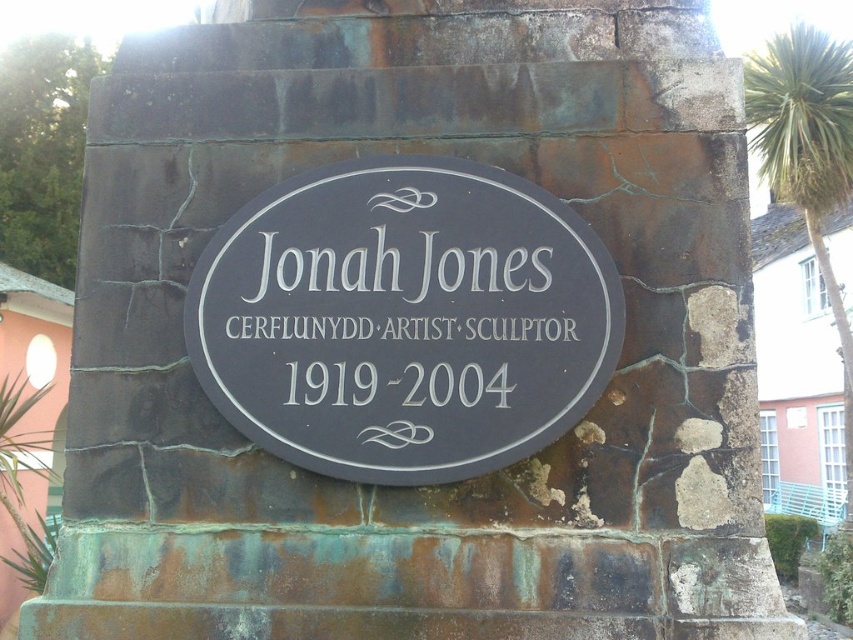
What do you see at coordinates (404, 320) in the screenshot? I see `black polished stone plaque at center` at bounding box center [404, 320].

Is black polished stone plaque at center wider than matte black plaque at center?

Yes.

Who is more forward, (398, 470) or (344, 307)?

Point (398, 470)

In order to click on black polished stone plaque at center in this screenshot , I will do coord(404,320).

Which is below, matte black plaque at center or green leafy palm tree at upper right?

matte black plaque at center is below.

Describe the element at coordinates (387, 317) in the screenshot. I see `matte black plaque at center` at that location.

I want to click on matte black plaque at center, so click(x=387, y=317).

Is black polished stone plaque at center positioned before green leafy palm tree at upper right?

Yes, black polished stone plaque at center is closer to the viewer.

Does black polished stone plaque at center appear over green leafy palm tree at upper right?

No.

This screenshot has width=853, height=640. I want to click on black polished stone plaque at center, so (404, 320).